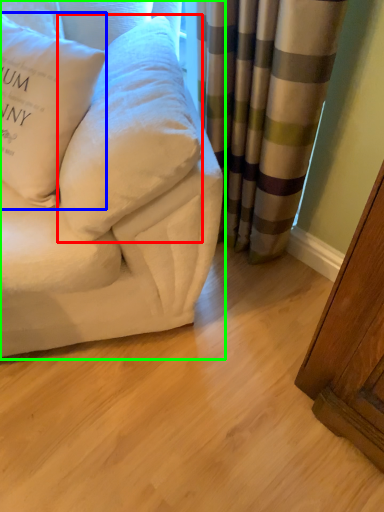
Question: Estimate the real-world distances between objects in this image. Which object is closer to pillow (highlighted by a red box), pillow (highlighted by a blue box) or studio couch (highlighted by a green box)?

Choices:
 (A) pillow
 (B) studio couch

Answer: (B)